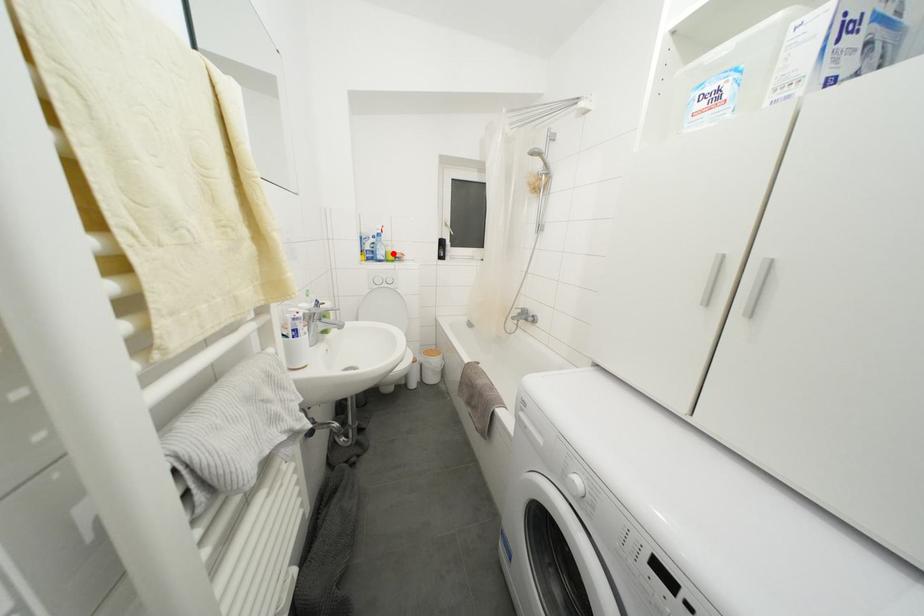
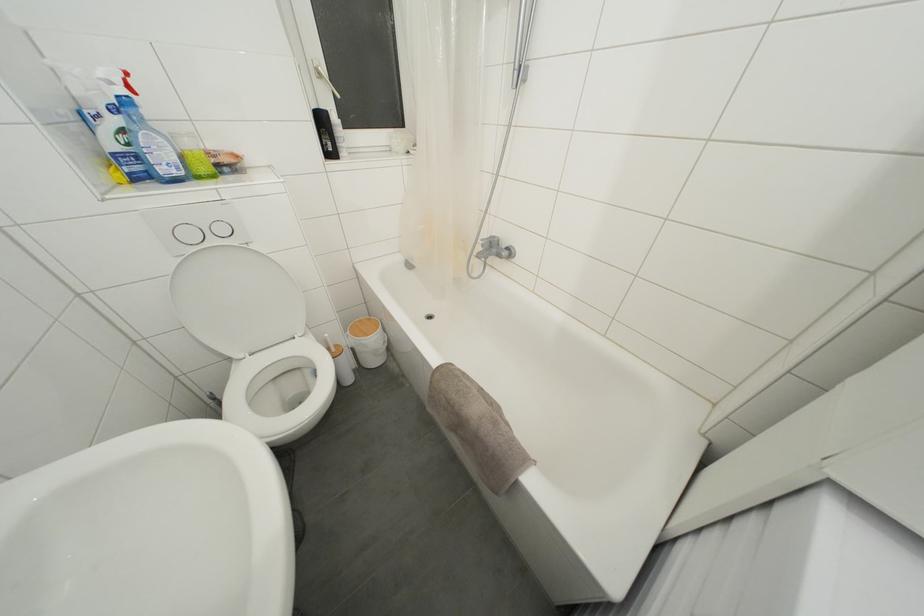
Find the pixel in the second image that matches the highlighted location in the first image.

(193, 148)